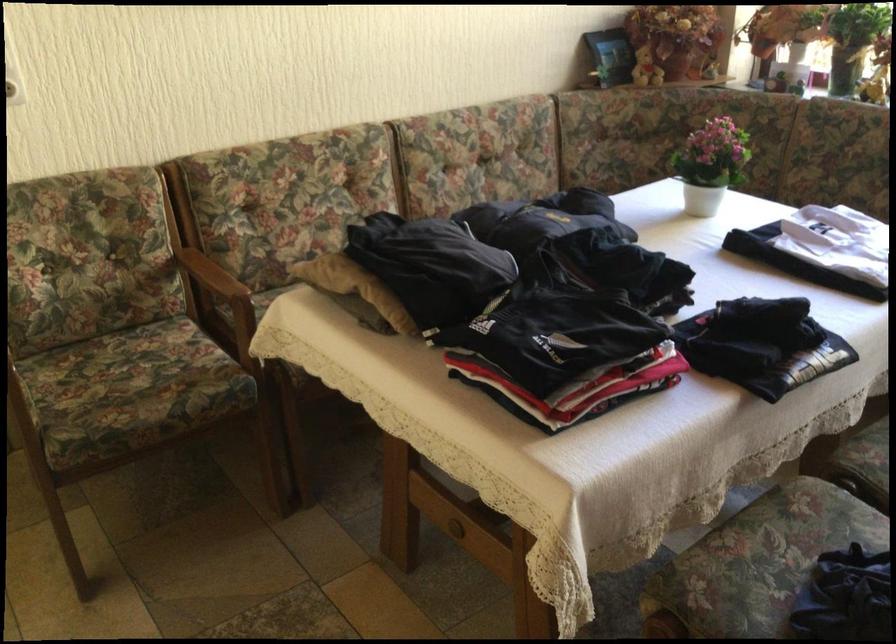
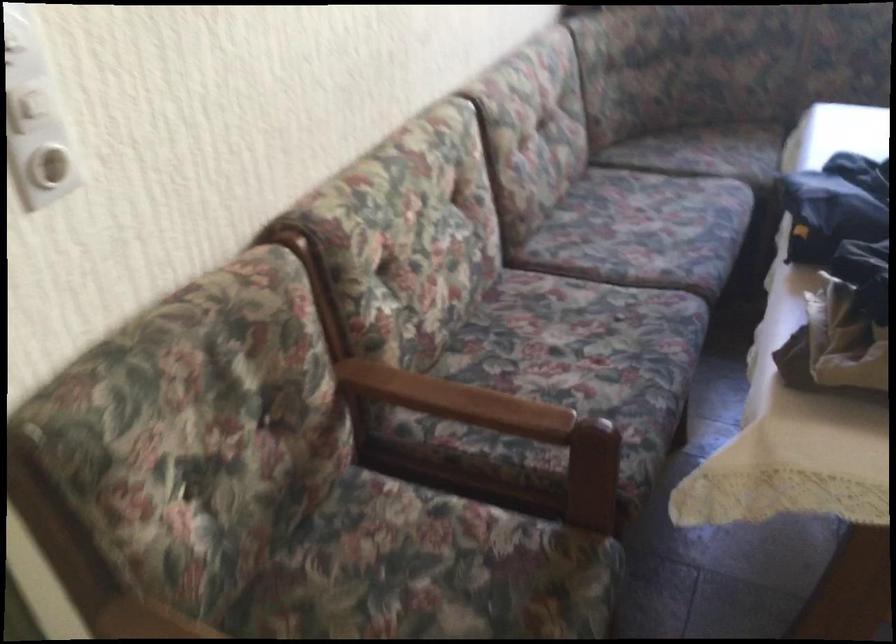
The images are taken continuously from a first-person perspective. In which direction are you moving?

The cameraman moved toward left, forward.